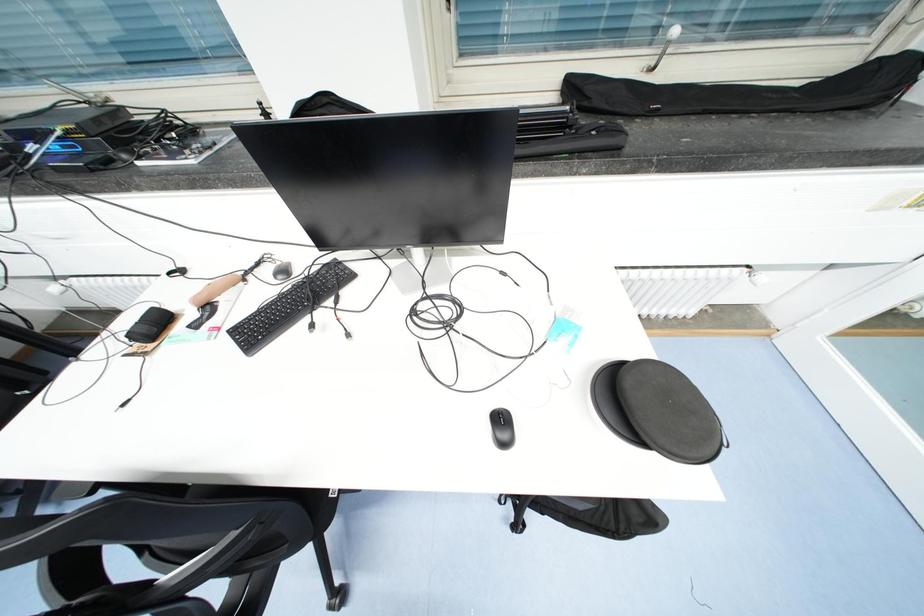
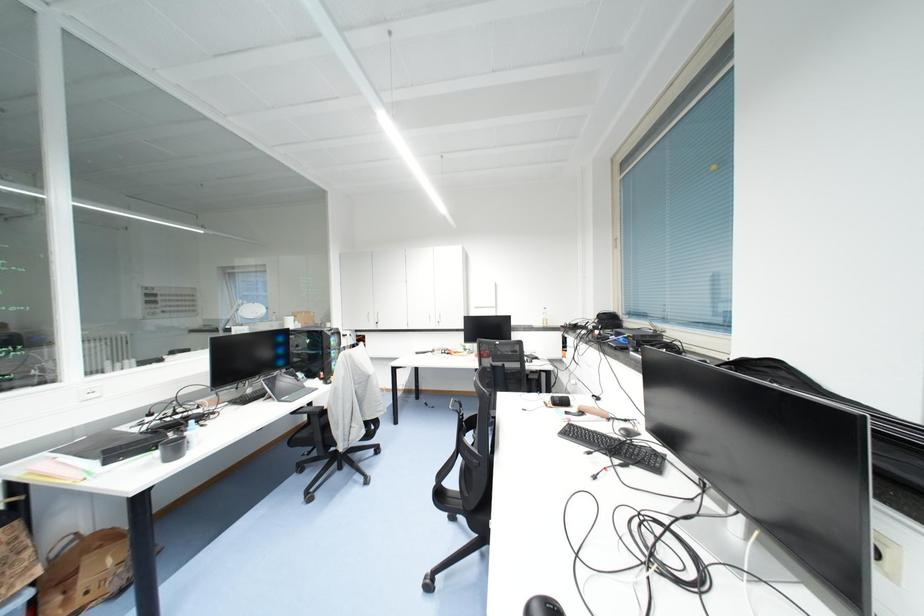
Question: Based on the continuous images, in which direction is the camera rotating? Reply with the corresponding letter.

Choices:
 (A) Left
 (B) Right
 (C) Up
 (D) Down

Answer: (A)